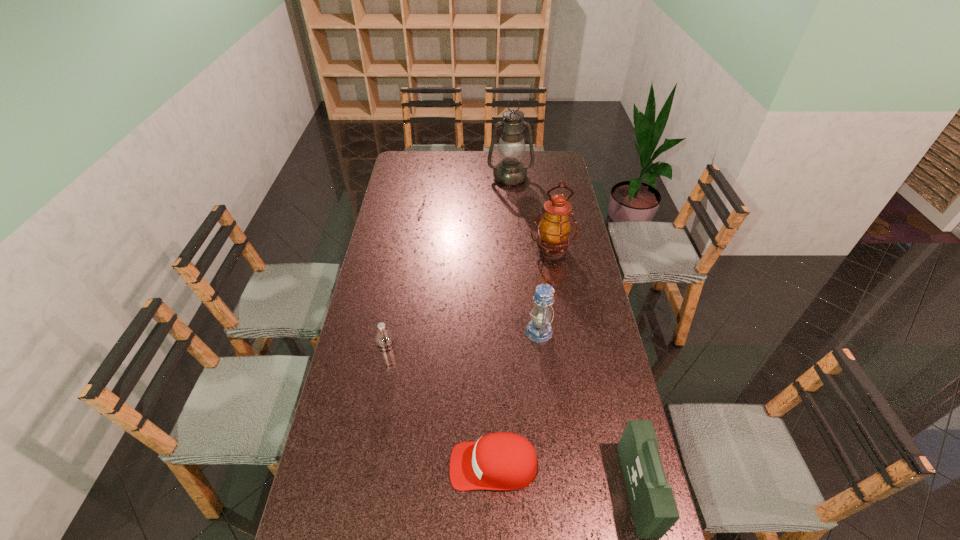
You are a GUI agent. You are given a task and a screenshot of the screen. Output one action in this format:
    pyautogui.click(x=<x>, y=<y>)
    Task: Click on the vacant area located 0.210m on the left of the taller oil lamp
    
    Given the screenshot: What is the action you would take?
    pyautogui.click(x=447, y=177)

Where is `blank area located on the front of the nearer oil lamp`? blank area located on the front of the nearer oil lamp is located at coordinates (559, 290).

Where is `blank area located 0.190m on the front-facing side of the lantern`? blank area located 0.190m on the front-facing side of the lantern is located at coordinates coord(473,332).

Locate an element on the screen. free space located 0.200m on the front-facing side of the lantern is located at coordinates (470, 332).

Image resolution: width=960 pixels, height=540 pixels. Find the location of `free space located on the front-facing side of the lantern`. free space located on the front-facing side of the lantern is located at coordinates (418, 332).

Locate an element on the screen. The width and height of the screenshot is (960, 540). vacant space located on the front label of the vodka is located at coordinates (371, 477).

Locate an element on the screen. The height and width of the screenshot is (540, 960). vacant space located 0.110m on the front-facing side of the first-aid kit is located at coordinates (587, 490).

Image resolution: width=960 pixels, height=540 pixels. Identify the location of vacant area located 0.100m on the front-facing side of the first-aid kit. (590, 490).

This screenshot has width=960, height=540. What are the coordinates of `blank space located on the front-facing side of the first-aid kit` in the screenshot? It's located at (510, 490).

The height and width of the screenshot is (540, 960). Identify the location of vacant space located 0.180m on the front-facing side of the shortest object. (387, 465).